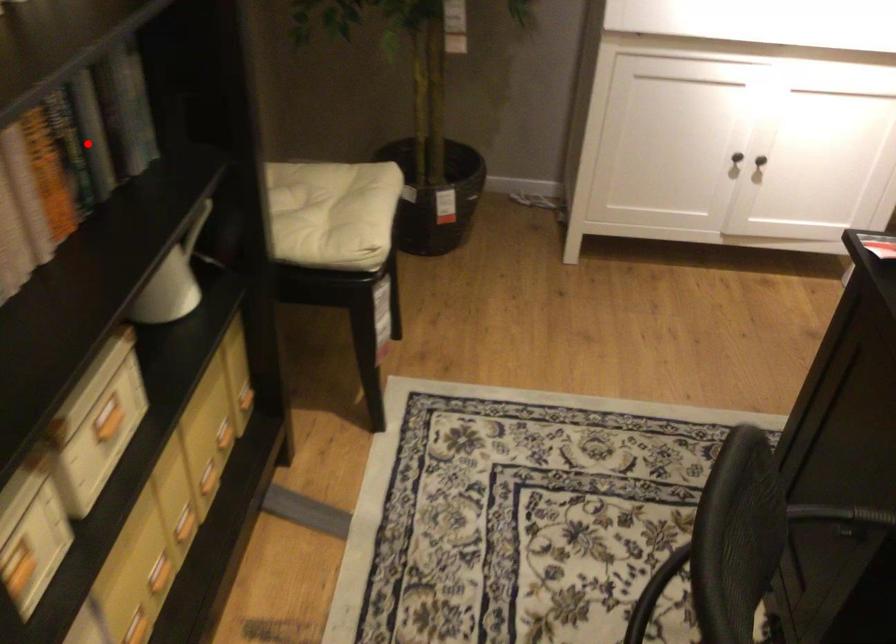
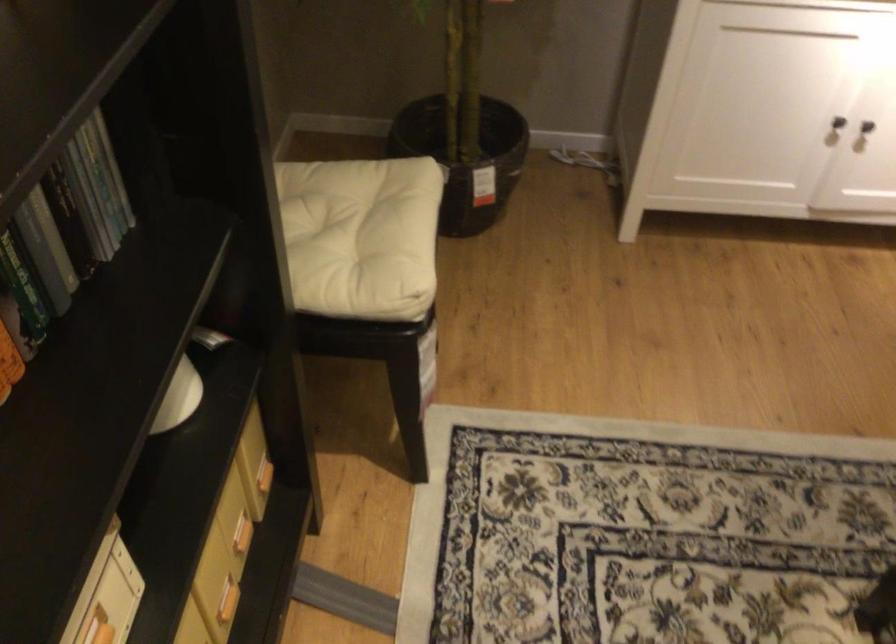
Find the pixel in the second image that matches the highlighted location in the first image.

(30, 240)